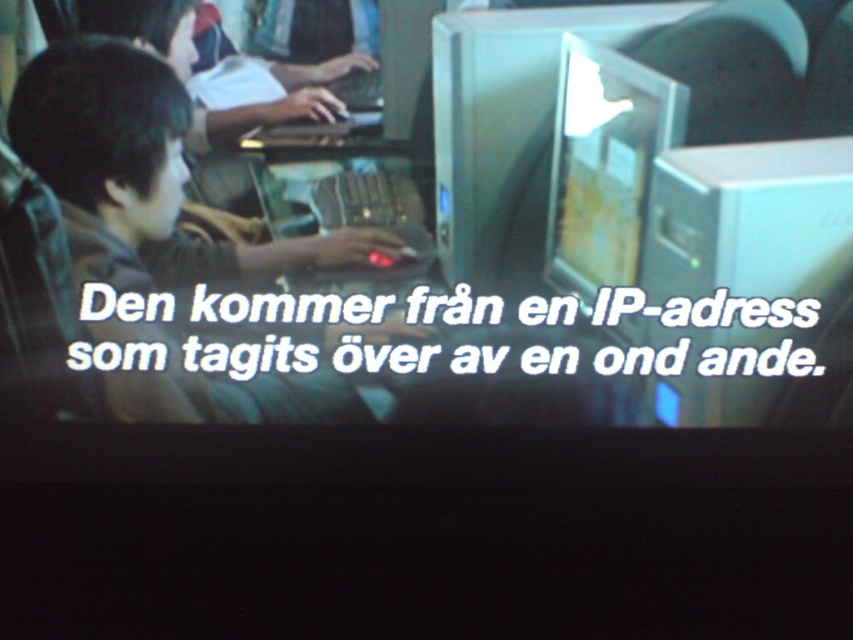
Question: Which point appears farthest from the camera in this image?

Choices:
 (A) (796, 285)
 (B) (45, 84)
 (C) (621, 36)
 (D) (670, 88)

Answer: (A)

Question: From the image, what is the correct spatial relationship of matte black laptop at left in relation to matte black monitor at center?

Choices:
 (A) right
 (B) left

Answer: (B)

Question: Does white plastic computer at right have a larger size compared to matte black monitor at center?

Choices:
 (A) no
 (B) yes

Answer: (B)

Question: Is white plastic computer at right further to the viewer compared to matte black monitor at center?

Choices:
 (A) no
 (B) yes

Answer: (B)

Question: Estimate the real-world distances between objects in this image. Which object is farther from the white plastic computer at right?

Choices:
 (A) metallic silver computer monitor at center
 (B) matte black laptop at left
 (C) matte black monitor at center

Answer: (B)

Question: Which is farther from the matte black monitor at center?

Choices:
 (A) metallic silver computer monitor at center
 (B) matte black laptop at left
 (C) white plastic computer at right

Answer: (B)